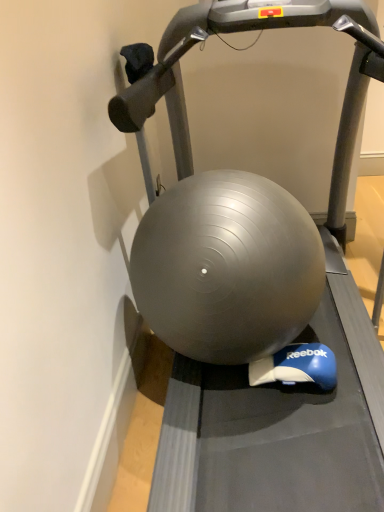
Question: Would you say matte gray ball at center is inside or outside silver metallic treadmill at center?

Choices:
 (A) outside
 (B) inside

Answer: (B)

Question: Is matte gray ball at center wider or thinner than silver metallic treadmill at center?

Choices:
 (A) wide
 (B) thin

Answer: (B)

Question: Is matte gray ball at center taller or shorter than silver metallic treadmill at center?

Choices:
 (A) short
 (B) tall

Answer: (A)

Question: Is silver metallic treadmill at center inside the boundaries of matte gray ball at center, or outside?

Choices:
 (A) inside
 (B) outside

Answer: (B)

Question: Is silver metallic treadmill at center wider or thinner than matte gray ball at center?

Choices:
 (A) wide
 (B) thin

Answer: (A)

Question: From the image's perspective, is silver metallic treadmill at center positioned above or below matte gray ball at center?

Choices:
 (A) above
 (B) below

Answer: (A)

Question: Is silver metallic treadmill at center bigger or smaller than matte gray ball at center?

Choices:
 (A) big
 (B) small

Answer: (A)